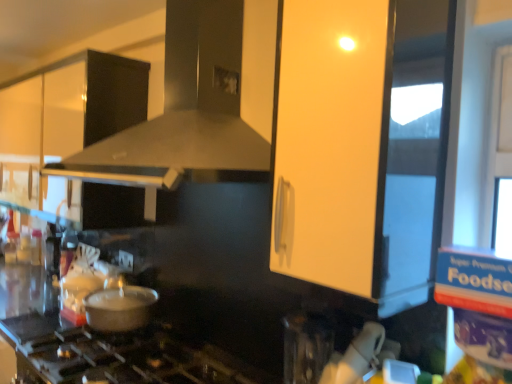
Question: Is white glossy cabinet at upper left in front of metallic silver pot at lower left?

Choices:
 (A) no
 (B) yes

Answer: (A)

Question: Is white glossy cabinet at upper left shorter than metallic silver pot at lower left?

Choices:
 (A) yes
 (B) no

Answer: (B)

Question: Considering the relative sizes of white glossy cabinet at upper left and metallic silver pot at lower left in the image provided, is white glossy cabinet at upper left bigger than metallic silver pot at lower left?

Choices:
 (A) no
 (B) yes

Answer: (B)

Question: Does white glossy cabinet at upper left touch metallic silver pot at lower left?

Choices:
 (A) no
 (B) yes

Answer: (A)

Question: Is white glossy cabinet at upper left outside of metallic silver pot at lower left?

Choices:
 (A) no
 (B) yes

Answer: (B)

Question: Based on their sizes in the image, would you say matte black vent at center is bigger or smaller than matte white cabinet at upper center?

Choices:
 (A) small
 (B) big

Answer: (B)

Question: Considering the positions of point (224, 38) and point (347, 210), is point (224, 38) closer or farther from the camera than point (347, 210)?

Choices:
 (A) closer
 (B) farther

Answer: (B)

Question: Would you say matte black vent at center is inside or outside matte white cabinet at upper center?

Choices:
 (A) outside
 (B) inside

Answer: (A)

Question: In terms of height, does matte black vent at center look taller or shorter compared to matte white cabinet at upper center?

Choices:
 (A) short
 (B) tall

Answer: (A)

Question: Is matte black vent at center wider or thinner than metallic silver pot at lower left?

Choices:
 (A) wide
 (B) thin

Answer: (A)

Question: Is matte black vent at center inside the boundaries of metallic silver pot at lower left, or outside?

Choices:
 (A) inside
 (B) outside

Answer: (B)

Question: From a real-world perspective, relative to metallic silver pot at lower left, is matte black vent at center vertically above or below?

Choices:
 (A) above
 (B) below

Answer: (A)

Question: Visually, is matte black vent at center positioned to the left or to the right of metallic silver pot at lower left?

Choices:
 (A) right
 (B) left

Answer: (A)

Question: From a real-world perspective, is matte white cabinet at upper center above or below white glossy cabinet at upper left?

Choices:
 (A) below
 (B) above

Answer: (A)

Question: Would you say matte white cabinet at upper center is to the left or to the right of white glossy cabinet at upper left in the picture?

Choices:
 (A) left
 (B) right

Answer: (B)